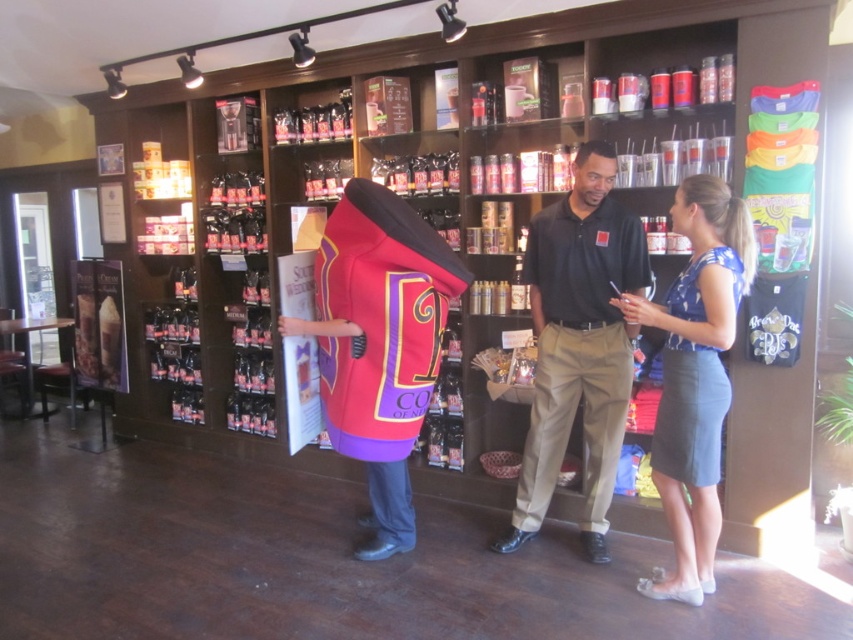
You are a store employee who needs to decide which item to place on the main display shelf. Given that the black cotton polo shirt at center and the blue satin blouse at center are both candidates, which one should you choose if the shelf can only accommodate one larger item?

The black cotton polo shirt at center is larger in size than the blue satin blouse at center, so you should choose the black cotton polo shirt at center for the main display shelf since it fits the requirement for a larger item.

What are the exact coordinates of the black cotton polo shirt at center?

The black cotton polo shirt at center is located at coordinates point (578,342).

You are a customer in the coffee shop and you want to buy both the black cotton polo shirt at center and the blue satin blouse at center. Which one is on the left side?

The black cotton polo shirt at center is to the left of the blue satin blouse at center.